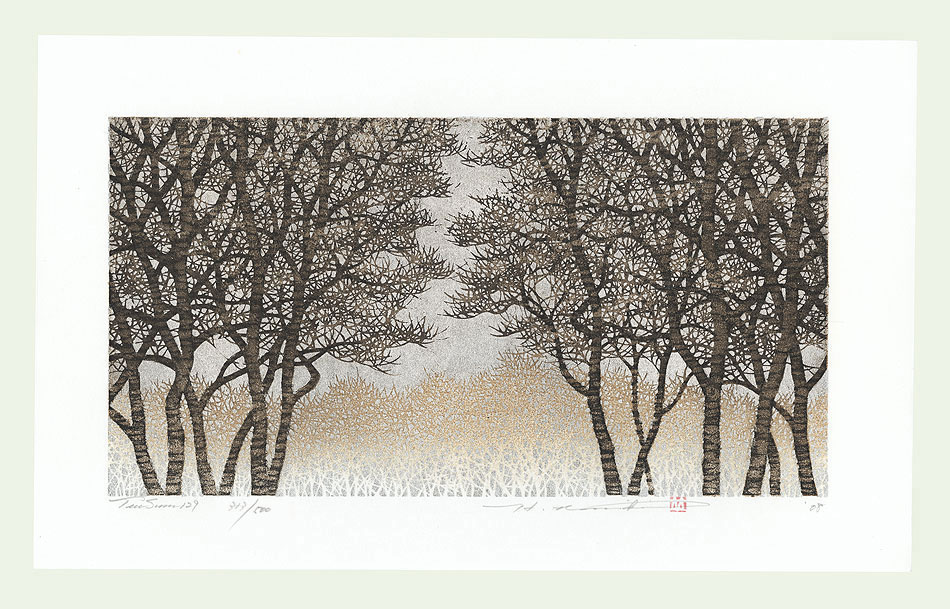
Locate an element on the screen. This screenshot has width=950, height=609. white mounting for the piece of art is located at coordinates (557, 79).